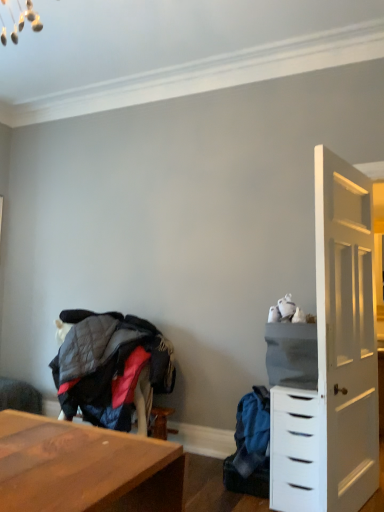
The width and height of the screenshot is (384, 512). What do you see at coordinates (292, 354) in the screenshot? I see `gray fabric cabinet at right` at bounding box center [292, 354].

Locate an element on the screen. The height and width of the screenshot is (512, 384). quilted fabric jacket at lower left, which is counted as the 1th clothing, starting from the left is located at coordinates (110, 367).

You are a GUI agent. You are given a task and a screenshot of the screen. Output one action in this format:
    pyautogui.click(x=<x>, y=<y>)
    Task: Click on the white matte chest of drawers at right
    The image size is (384, 512).
    Given the screenshot: What is the action you would take?
    pyautogui.click(x=304, y=455)

Is blue fabric backpack at lower right, positioned as the second clothing in left-to-right order, to the right of wooden swivel chair at lower left from the viewer's perspective?

Yes, blue fabric backpack at lower right, positioned as the second clothing in left-to-right order, is to the right of wooden swivel chair at lower left.

Which object is closer to the camera taking this photo, blue fabric backpack at lower right, acting as the first clothing starting from the right, or wooden swivel chair at lower left?

blue fabric backpack at lower right, acting as the first clothing starting from the right, is more forward.

How distant is blue fabric backpack at lower right, positioned as the second clothing in left-to-right order, from wooden swivel chair at lower left?

2.11 meters.

From the image's perspective, which object appears higher, gray fabric cabinet at right or blue fabric backpack at lower right, acting as the first clothing starting from the right?

gray fabric cabinet at right, from the image's perspective.

From the picture: Could blue fabric backpack at lower right, acting as the first clothing starting from the right, be considered to be inside gray fabric cabinet at right?

No, gray fabric cabinet at right does not contain blue fabric backpack at lower right, acting as the first clothing starting from the right.

Image resolution: width=384 pixels, height=512 pixels. There is a blue fabric backpack at lower right, acting as the first clothing starting from the right. What are the coordinates of `cabinetry above it (from a real-world perspective)` in the screenshot? It's located at (292, 354).

Based on the photo, between gray fabric cabinet at right and blue fabric backpack at lower right, acting as the first clothing starting from the right, which one appears on the right side from the viewer's perspective?

gray fabric cabinet at right.

Can you confirm if quilted fabric jacket at lower left, which is counted as the 1th clothing, starting from the left, is taller than white matte chest of drawers at right?

No, quilted fabric jacket at lower left, which is counted as the 1th clothing, starting from the left, is not taller than white matte chest of drawers at right.

Considering their positions, is quilted fabric jacket at lower left, which is counted as the 1th clothing, starting from the left, located in front of or behind white matte chest of drawers at right?

In the image, quilted fabric jacket at lower left, which is counted as the 1th clothing, starting from the left, appears behind white matte chest of drawers at right.

Based on the photo, does quilted fabric jacket at lower left, which is counted as the 2th clothing, starting from the right, have a lesser width compared to white matte chest of drawers at right?

Indeed, quilted fabric jacket at lower left, which is counted as the 2th clothing, starting from the right, has a lesser width compared to white matte chest of drawers at right.

Between quilted fabric jacket at lower left, which is counted as the 2th clothing, starting from the right, and white matte chest of drawers at right, which one appears on the right side from the viewer's perspective?

white matte chest of drawers at right is more to the right.

From the image's perspective, which one is positioned higher, white matte chest of drawers at right or wooden swivel chair at lower left?

white matte chest of drawers at right is shown above in the image.

Is wooden swivel chair at lower left at the back of white matte chest of drawers at right?

white matte chest of drawers at right is not turned away from wooden swivel chair at lower left.

Considering the relative sizes of white matte chest of drawers at right and wooden swivel chair at lower left in the image provided, is white matte chest of drawers at right bigger than wooden swivel chair at lower left?

Yes.

Locate an element on the screen. the chest of drawers located in front of the wooden swivel chair at lower left is located at coordinates (304, 455).

Is wooden swivel chair at lower left positioned before quilted fabric jacket at lower left, which is counted as the 1th clothing, starting from the left?

No, it is behind quilted fabric jacket at lower left, which is counted as the 1th clothing, starting from the left.

In order to click on the 1st clothing to the right when counting from the wooden swivel chair at lower left in this screenshot , I will do `click(110, 367)`.

Considering the sizes of objects wooden swivel chair at lower left and quilted fabric jacket at lower left, which is counted as the 1th clothing, starting from the left, in the image provided, who is smaller, wooden swivel chair at lower left or quilted fabric jacket at lower left, which is counted as the 1th clothing, starting from the left,?

Smaller between the two is quilted fabric jacket at lower left, which is counted as the 1th clothing, starting from the left.

Is point (10, 390) positioned after point (96, 407)?

That is True.

Consider the image. Measure the distance from white matte chest of drawers at right to blue fabric backpack at lower right, positioned as the second clothing in left-to-right order.

white matte chest of drawers at right is 10.19 inches from blue fabric backpack at lower right, positioned as the second clothing in left-to-right order.

Is white matte chest of drawers at right turned away from blue fabric backpack at lower right, positioned as the second clothing in left-to-right order?

That's not correct — white matte chest of drawers at right is not looking away from blue fabric backpack at lower right, positioned as the second clothing in left-to-right order.

Which object is further away from the camera taking this photo, white matte chest of drawers at right or blue fabric backpack at lower right, positioned as the second clothing in left-to-right order?

blue fabric backpack at lower right, positioned as the second clothing in left-to-right order, is behind.

Considering the sizes of objects white matte chest of drawers at right and blue fabric backpack at lower right, positioned as the second clothing in left-to-right order, in the image provided, who is shorter, white matte chest of drawers at right or blue fabric backpack at lower right, positioned as the second clothing in left-to-right order,?

blue fabric backpack at lower right, positioned as the second clothing in left-to-right order, is shorter.

From a real-world perspective, is white matte chest of drawers at right over gray fabric cabinet at right?

No.

Does point (283, 509) appear closer or farther from the camera than point (284, 376)?

Point (283, 509) is closer to the camera than point (284, 376).

From the image's perspective, is white matte chest of drawers at right over gray fabric cabinet at right?

Actually, white matte chest of drawers at right appears below gray fabric cabinet at right in the image.

Is white matte chest of drawers at right behind gray fabric cabinet at right?

That is False.

There is a wooden swivel chair at lower left. In order to click on the 1st clothing above it (from the image's perspective) in this screenshot , I will do [252, 431].

Locate an element on the screen. This screenshot has height=512, width=384. cabinetry on the right of blue fabric backpack at lower right, acting as the first clothing starting from the right is located at coordinates coord(292,354).

Based on their spatial positions, is wooden swivel chair at lower left or white matte chest of drawers at right further from quilted fabric jacket at lower left, which is counted as the 2th clothing, starting from the right?

Among the two, white matte chest of drawers at right is located further to quilted fabric jacket at lower left, which is counted as the 2th clothing, starting from the right.

When comparing their distances from quilted fabric jacket at lower left, which is counted as the 1th clothing, starting from the left, does wooden swivel chair at lower left or blue fabric backpack at lower right, positioned as the second clothing in left-to-right order, seem closer?

The object closer to quilted fabric jacket at lower left, which is counted as the 1th clothing, starting from the left, is blue fabric backpack at lower right, positioned as the second clothing in left-to-right order.

From the image, which object appears to be farther from wooden swivel chair at lower left, quilted fabric jacket at lower left, which is counted as the 2th clothing, starting from the right, or blue fabric backpack at lower right, positioned as the second clothing in left-to-right order?

blue fabric backpack at lower right, positioned as the second clothing in left-to-right order, lies further to wooden swivel chair at lower left than the other object.

Based on the photo, looking at the image, which one is located further to gray fabric cabinet at right, wooden swivel chair at lower left or quilted fabric jacket at lower left, which is counted as the 1th clothing, starting from the left?

wooden swivel chair at lower left is further to gray fabric cabinet at right.

Based on their spatial positions, is wooden swivel chair at lower left or quilted fabric jacket at lower left, which is counted as the 2th clothing, starting from the right, closer to white matte chest of drawers at right?

Among the two, quilted fabric jacket at lower left, which is counted as the 2th clothing, starting from the right, is located nearer to white matte chest of drawers at right.

From the image, which object appears to be farther from quilted fabric jacket at lower left, which is counted as the 1th clothing, starting from the left, wooden swivel chair at lower left or gray fabric cabinet at right?

Among the two, gray fabric cabinet at right is located further to quilted fabric jacket at lower left, which is counted as the 1th clothing, starting from the left.

Based on the photo, from the image, which object appears to be nearer to wooden swivel chair at lower left, white matte chest of drawers at right or quilted fabric jacket at lower left, which is counted as the 2th clothing, starting from the right?

The object closer to wooden swivel chair at lower left is quilted fabric jacket at lower left, which is counted as the 2th clothing, starting from the right.

Considering their positions, is blue fabric backpack at lower right, positioned as the second clothing in left-to-right order, positioned further to white matte chest of drawers at right than quilted fabric jacket at lower left, which is counted as the 2th clothing, starting from the right?

quilted fabric jacket at lower left, which is counted as the 2th clothing, starting from the right.

You are a GUI agent. You are given a task and a screenshot of the screen. Output one action in this format:
    pyautogui.click(x=<x>, y=<y>)
    Task: Click on the clothing between wooden swivel chair at lower left and blue fabric backpack at lower right, acting as the first clothing starting from the right, from left to right
    This screenshot has height=512, width=384.
    Given the screenshot: What is the action you would take?
    pyautogui.click(x=110, y=367)

Identify the location of cabinetry located between quilted fabric jacket at lower left, which is counted as the 1th clothing, starting from the left, and white matte chest of drawers at right in the left-right direction. (292, 354).

Locate an element on the screen. The height and width of the screenshot is (512, 384). chest of drawers between gray fabric cabinet at right and blue fabric backpack at lower right, positioned as the second clothing in left-to-right order, in the vertical direction is located at coordinates (304, 455).

This screenshot has width=384, height=512. Identify the location of clothing situated between quilted fabric jacket at lower left, which is counted as the 2th clothing, starting from the right, and gray fabric cabinet at right from left to right. (252, 431).